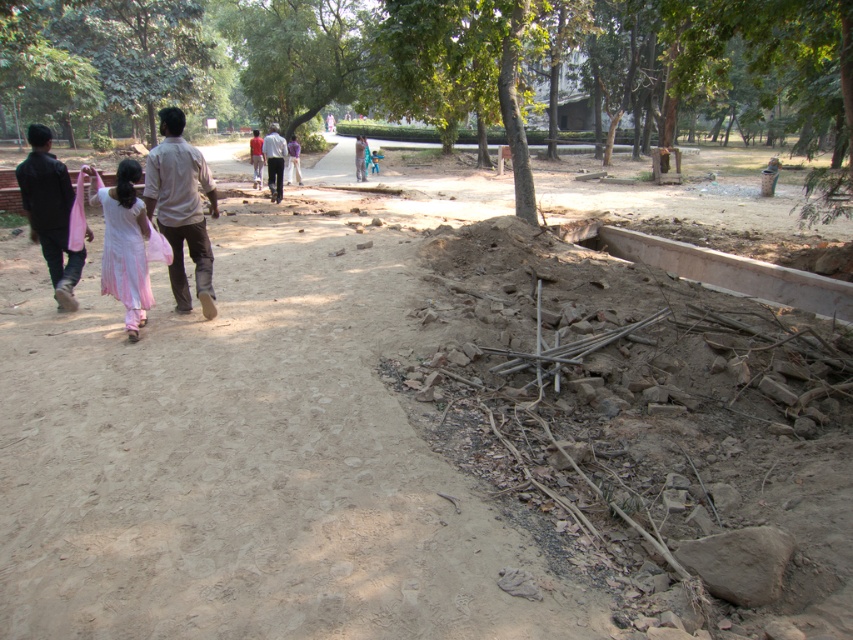
You are a pedestrian walking on the dirt path in the park. You see two people ahead of you wearing a light brown shirt at center and a light beige cotton shirt at center. Which person is wearing a smaller sized shirt?

The light brown shirt at center has a smaller size compared to the light beige cotton shirt at center, so the person wearing the light brown shirt at center is wearing the smaller sized shirt.